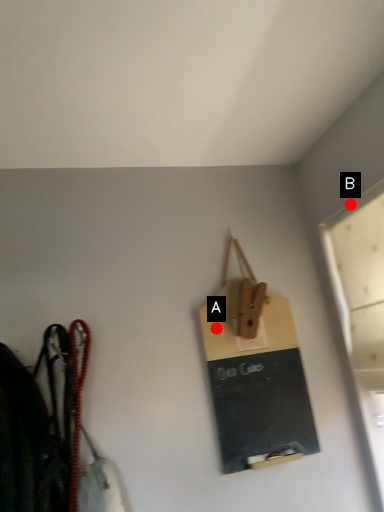
Question: Two points are circled on the image, labeled by A and B beside each circle. Among these points, which one is nearest to the camera?

Choices:
 (A) A is closer
 (B) B is closer

Answer: (B)